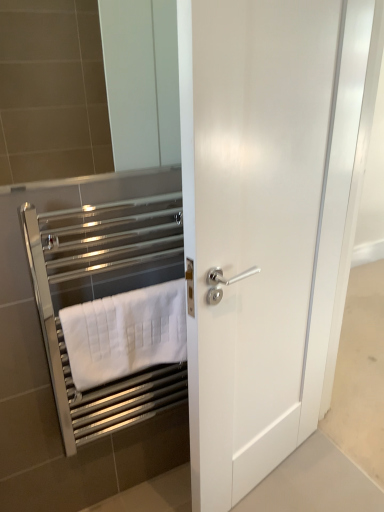
Question: Choose the correct answer: Is chrome metallic towel rack at left inside white matte towel at left or outside it?

Choices:
 (A) inside
 (B) outside

Answer: (B)

Question: Relative to white matte towel at left, is chrome metallic towel rack at left in front or behind?

Choices:
 (A) front
 (B) behind

Answer: (A)

Question: Which is nearer to the chrome metallic towel rack at left?

Choices:
 (A) white matte towel at left
 (B) white glossy door at center

Answer: (A)

Question: Which is nearer to the white glossy door at center?

Choices:
 (A) chrome metallic towel rack at left
 (B) white matte towel at left

Answer: (B)